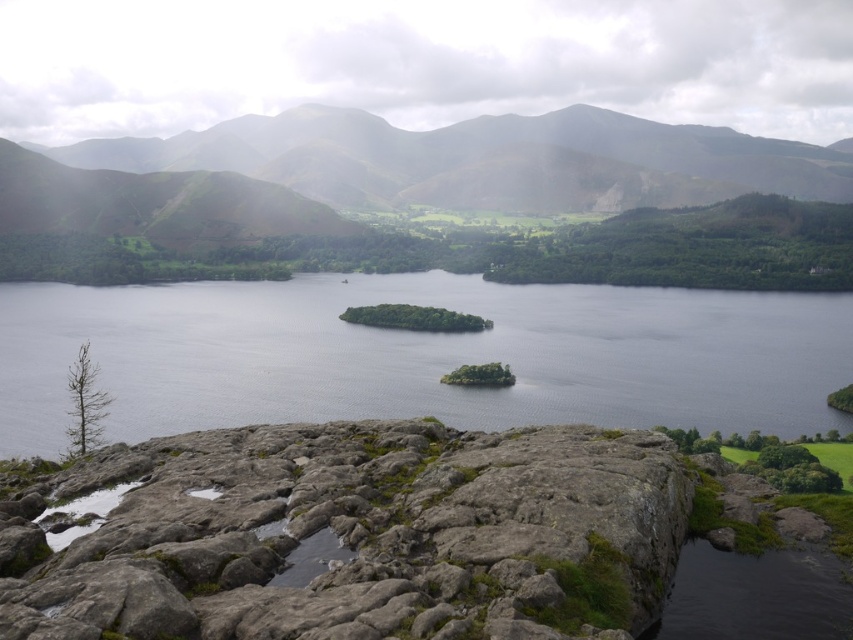
Question: Based on their relative distances, which object is farther from the gray rock at bottom?

Choices:
 (A) clear water at center
 (B) green grassy hill at upper center

Answer: (B)

Question: In this image, where is gray rock at bottom located relative to green grassy hill at upper center?

Choices:
 (A) right
 (B) left

Answer: (B)

Question: Which point is farther to the camera?

Choices:
 (A) green grassy hill at upper center
 (B) gray rock at bottom
 (C) clear water at center

Answer: (A)

Question: From the image, what is the correct spatial relationship of clear water at center in relation to green grassy hill at upper center?

Choices:
 (A) below
 (B) above

Answer: (A)

Question: Is gray rock at bottom wider than clear water at center?

Choices:
 (A) no
 (B) yes

Answer: (A)

Question: Which point is farther from the camera taking this photo?

Choices:
 (A) (149, 328)
 (B) (680, 131)
 (C) (498, 451)

Answer: (B)